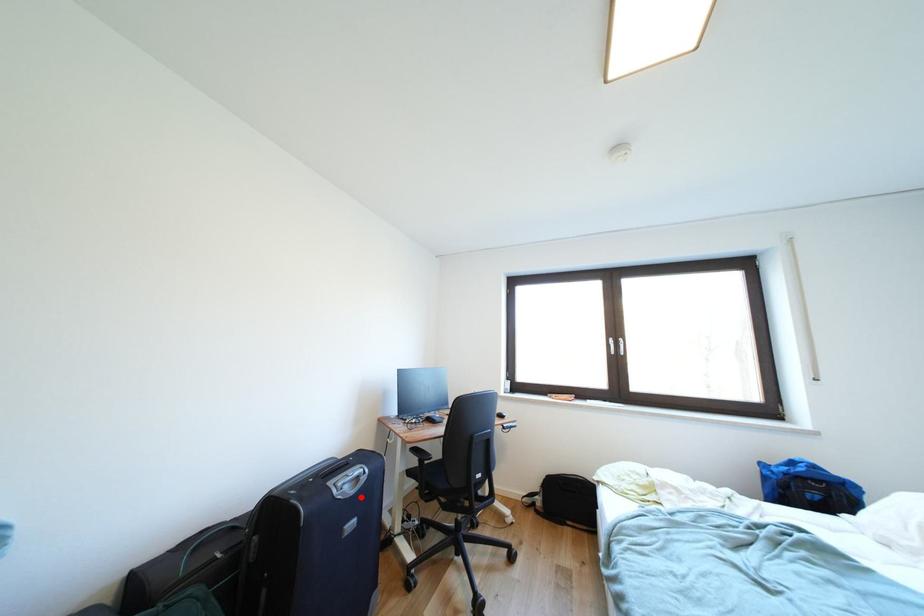
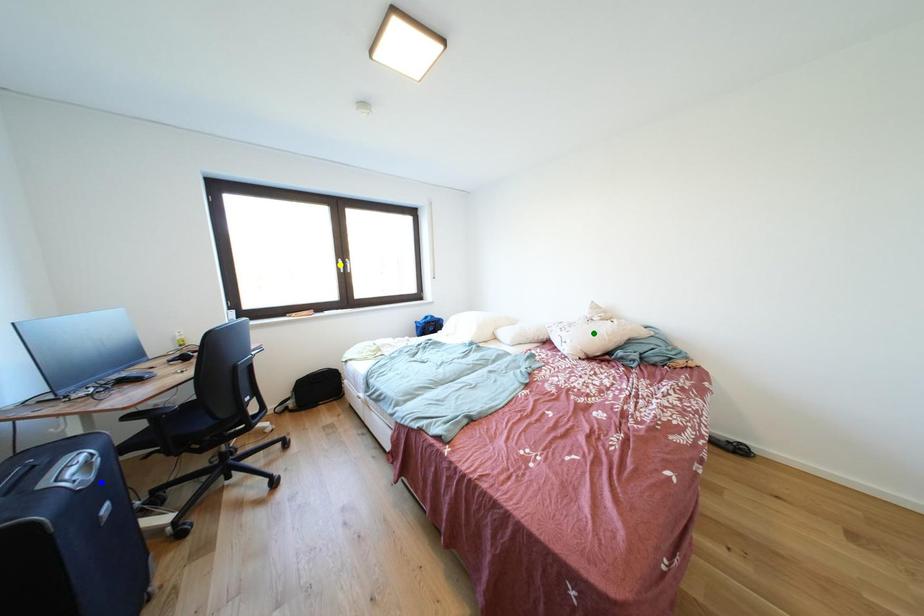
Question: I am providing you with two images of the same scene from different viewpoints. A red point is marked on the first image. You are given multiple points on the second image. Which spot in image 2 lines up with the point in image 1?

Choices:
 (A) yellow point
 (B) green point
 (C) blue point

Answer: (C)